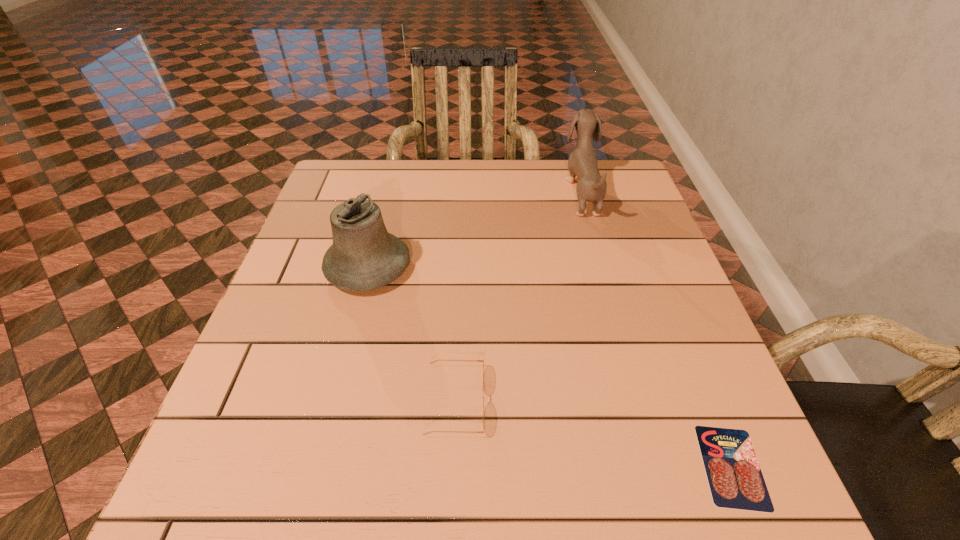
Identify the location of free space located 0.340m at the face of the puppy. (444, 192).

Locate an element on the screen. vacant position located on the back of the second farthest object is located at coordinates (379, 222).

Locate an element on the screen. vacant area situated on the face of the sunglasses is located at coordinates (608, 400).

Find the location of a particular element. vacant space located on the left of the shortest object is located at coordinates (612, 467).

At what (x,y) coordinates should I click in order to perform the action: click on object that is at the far edge. Please return your answer as a coordinate pair (x, y). The width and height of the screenshot is (960, 540). Looking at the image, I should click on 591,186.

Where is `object that is at the near edge`? object that is at the near edge is located at coordinates (734, 475).

Where is `object that is at the left edge`? This screenshot has width=960, height=540. object that is at the left edge is located at coordinates (364, 256).

Locate an element on the screen. Image resolution: width=960 pixels, height=540 pixels. puppy that is at the right edge is located at coordinates (591, 186).

Image resolution: width=960 pixels, height=540 pixels. Identify the location of salami that is at the right edge. (734, 475).

Identify the location of object at the far right corner. (591, 186).